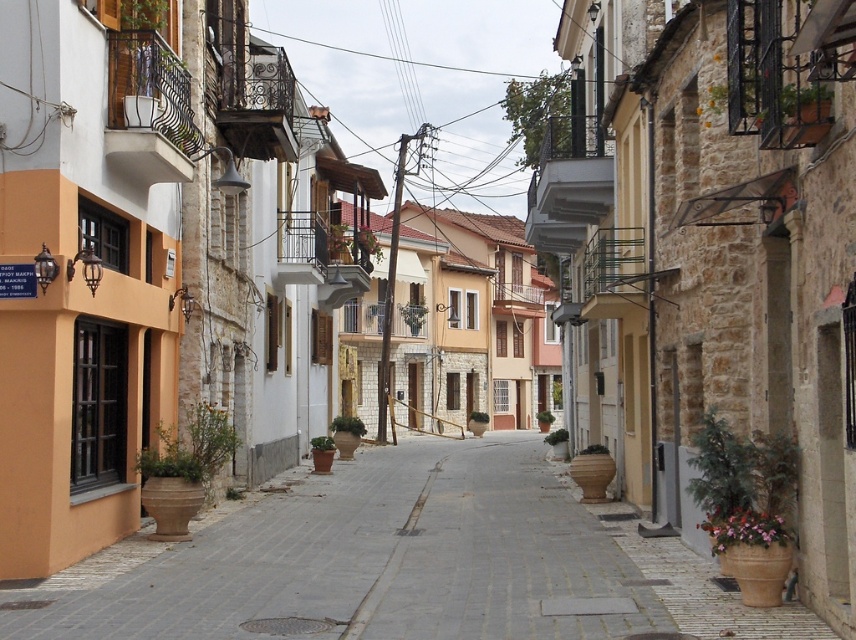
You are a delivery person with a cart that is 30 inches wide. You need to navigate through the narrow street and pass between the terracotta clay pots at center and the smooth concrete sidewalk at center. Can your cart fit through the space between them?

The distance between the terracotta clay pots at center and the smooth concrete sidewalk at center is 24.68 inches. Since your cart is 30 inches wide, it cannot fit through the space as the available width is narrower than the cart.

You are a delivery person trying to navigate a narrow street with a cart that is 1.2 meters wide. You see the terracotta clay pots at center and the smooth concrete sidewalk at center. Which side of the sidewalk should you stay on to avoid the pots?

The terracotta clay pots at center are on the left side of the smooth concrete sidewalk at center, so you should stay on the right side of the sidewalk to avoid them.